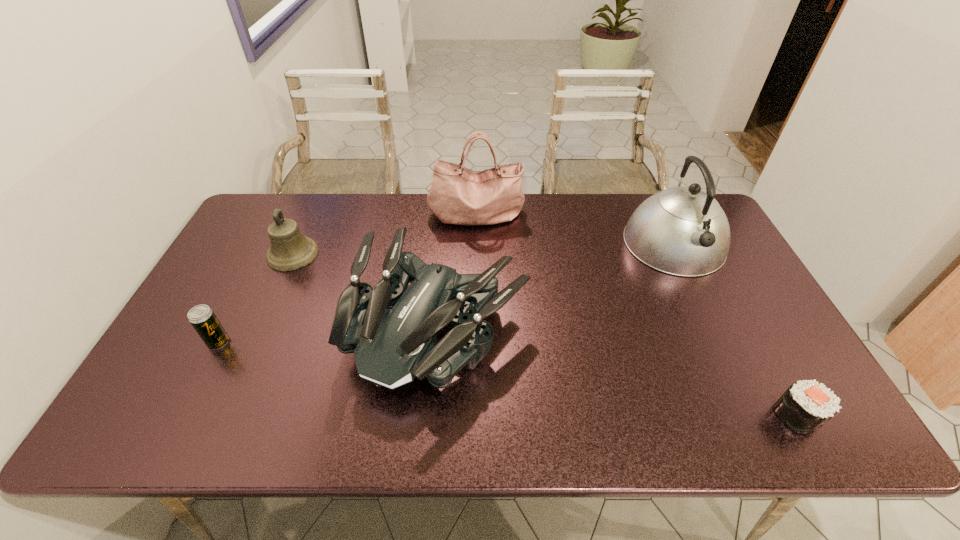
In order to click on free spot between the sushi and the kettle in this screenshot , I will do `click(736, 330)`.

Find the location of `free point between the shortest object and the drone`. free point between the shortest object and the drone is located at coordinates (618, 373).

This screenshot has height=540, width=960. Find the location of `blank region between the beer can and the drone`. blank region between the beer can and the drone is located at coordinates (328, 336).

Point out which object is positioned as the fourth nearest to the bell. Please provide its 2D coordinates. Your answer should be formatted as a tuple, i.e. [(x, y)], where the tuple contains the x and y coordinates of a point satisfying the conditions above.

[(683, 231)]

Select which object appears as the third closest to the shortest object. Please provide its 2D coordinates. Your answer should be formatted as a tuple, i.e. [(x, y)], where the tuple contains the x and y coordinates of a point satisfying the conditions above.

[(458, 195)]

At what (x,y) coordinates should I click in order to perform the action: click on free space that satisfies the following two spatial constraints: 1. on the front side of the drone; 2. on the right side of the bell. Please return your answer as a coordinate pair (x, y). This screenshot has height=540, width=960. Looking at the image, I should click on (259, 329).

Image resolution: width=960 pixels, height=540 pixels. What are the coordinates of `free space in the image that satisfies the following two spatial constraints: 1. from the spout of the shortest object; 2. on the right side of the kettle` in the screenshot? It's located at (756, 416).

The height and width of the screenshot is (540, 960). I want to click on free space that satisfies the following two spatial constraints: 1. on the back side of the drone; 2. on the left side of the fifth tallest object, so click(226, 329).